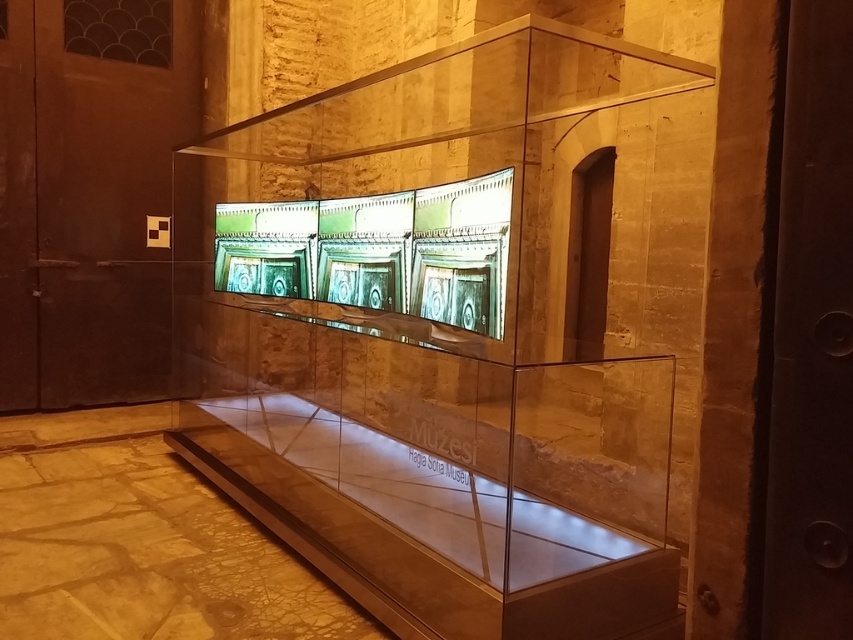
Question: Considering the real-world distances, which object is farthest from the transparent glass display case at center?

Choices:
 (A) brown wooden door at left
 (B) transparent glass table at center

Answer: (A)

Question: Which point is farther from the camera taking this photo?

Choices:
 (A) (418, 113)
 (B) (329, 460)

Answer: (A)

Question: Does brown wooden door at left lie in front of transparent glass table at center?

Choices:
 (A) no
 (B) yes

Answer: (A)

Question: Which point is farther from the camera taking this photo?

Choices:
 (A) (367, 227)
 (B) (543, 484)
 (C) (119, 385)

Answer: (C)

Question: Is transparent glass display case at center thinner than transparent glass table at center?

Choices:
 (A) yes
 (B) no

Answer: (B)

Question: Is brown wooden door at left to the right of transparent glass table at center from the viewer's perspective?

Choices:
 (A) no
 (B) yes

Answer: (A)